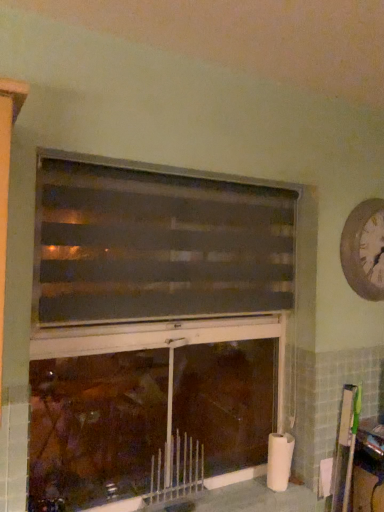
Question: From the image's perspective, is dark brown textured blinds at center located above matte brown fireplace at center?

Choices:
 (A) no
 (B) yes

Answer: (B)

Question: Does dark brown textured blinds at center have a larger size compared to matte brown fireplace at center?

Choices:
 (A) no
 (B) yes

Answer: (A)

Question: Is dark brown textured blinds at center positioned far away from matte brown fireplace at center?

Choices:
 (A) yes
 (B) no

Answer: (B)

Question: From a real-world perspective, is dark brown textured blinds at center on matte brown fireplace at center?

Choices:
 (A) yes
 (B) no

Answer: (A)

Question: Is the surface of dark brown textured blinds at center in direct contact with matte brown fireplace at center?

Choices:
 (A) no
 (B) yes

Answer: (A)

Question: Considering the relative positions of dark brown textured blinds at center and matte brown fireplace at center in the image provided, is dark brown textured blinds at center to the right of matte brown fireplace at center from the viewer's perspective?

Choices:
 (A) yes
 (B) no

Answer: (A)

Question: Is wooden bulletin board at right outside of dark brown textured blinds at center?

Choices:
 (A) yes
 (B) no

Answer: (A)

Question: Is wooden bulletin board at right looking in the opposite direction of dark brown textured blinds at center?

Choices:
 (A) no
 (B) yes

Answer: (A)

Question: Does wooden bulletin board at right turn towards dark brown textured blinds at center?

Choices:
 (A) yes
 (B) no

Answer: (B)

Question: Can you confirm if wooden bulletin board at right is taller than dark brown textured blinds at center?

Choices:
 (A) no
 (B) yes

Answer: (B)

Question: Can you confirm if wooden bulletin board at right is positioned to the left of dark brown textured blinds at center?

Choices:
 (A) yes
 (B) no

Answer: (B)

Question: Is wooden bulletin board at right far away from dark brown textured blinds at center?

Choices:
 (A) yes
 (B) no

Answer: (B)

Question: From a real-world perspective, is dark brown textured blinds at center over white textured clock at upper right?

Choices:
 (A) no
 (B) yes

Answer: (A)